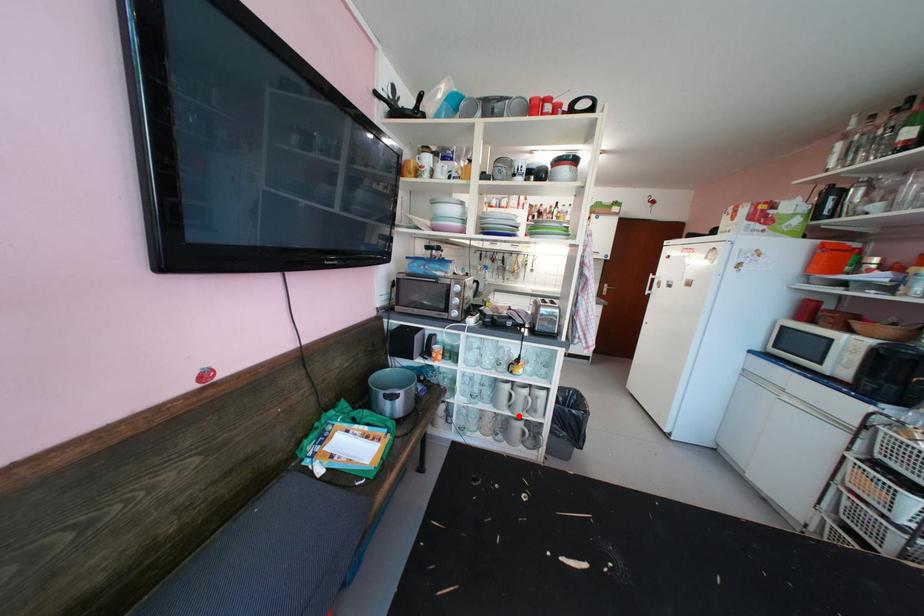
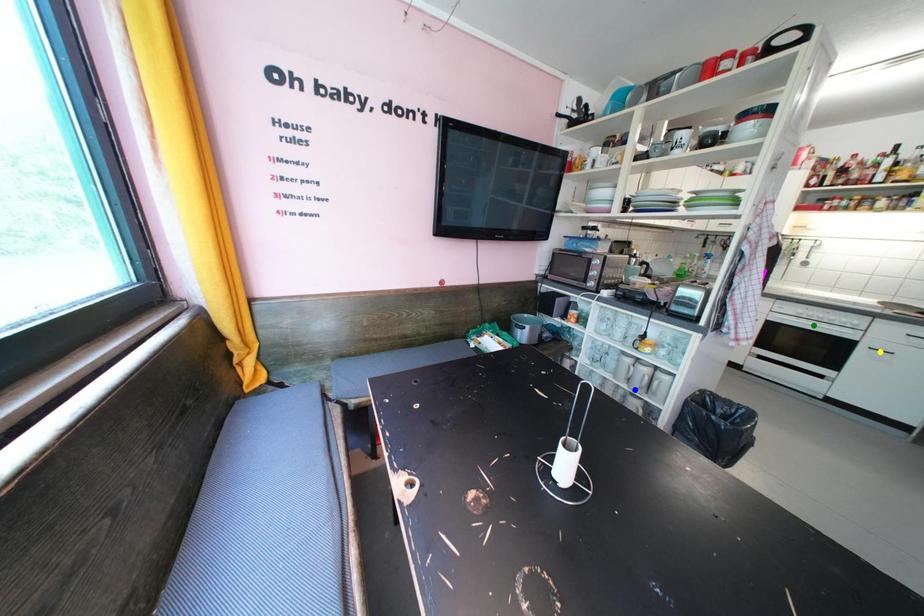
Question: I am providing you with two images of the same scene from different viewpoints. A red point is marked on the first image. You are given multiple points on the second image. In image 2, which mark is for the same physical point as the one in image 1?

Choices:
 (A) yellow point
 (B) blue point
 (C) green point

Answer: (B)